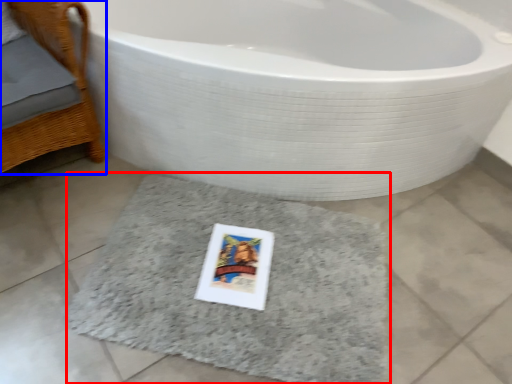
Question: Among these objects, which one is farthest to the camera, bath mat (highlighted by a red box) or furniture (highlighted by a blue box)?

Choices:
 (A) bath mat
 (B) furniture

Answer: (A)